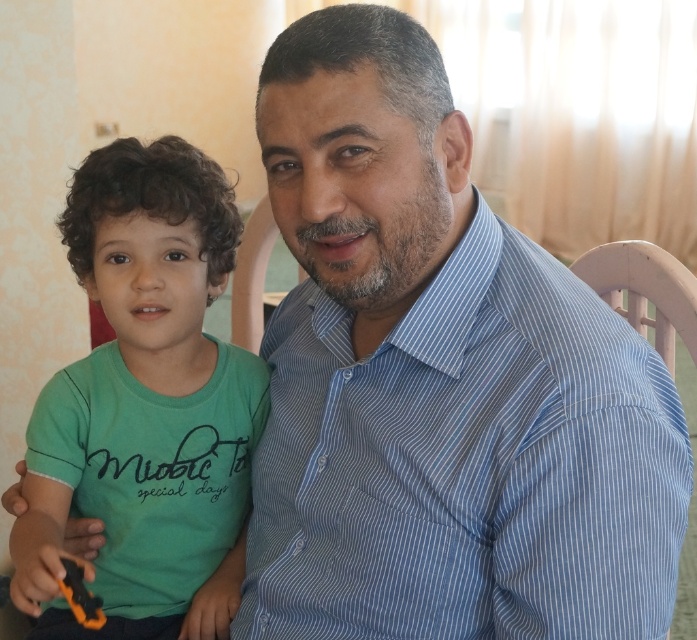
Who is positioned more to the left, green matte shirt at left or orange plastic toy at lower left?

orange plastic toy at lower left

Which is in front, point (256, 369) or point (79, 573)?

Point (79, 573) is more forward.

Describe the element at coordinates (155, 384) in the screenshot. The width and height of the screenshot is (697, 640). I see `green matte shirt at left` at that location.

The width and height of the screenshot is (697, 640). Identify the location of green matte shirt at left. coord(155,384).

Can you confirm if blue striped shirt at center is positioned below green matte shirt at left?

Yes.

Does blue striped shirt at center appear over green matte shirt at left?

No.

Does point (474, 392) come behind point (187, 627)?

No, it is not.

Image resolution: width=697 pixels, height=640 pixels. I want to click on blue striped shirt at center, so click(x=467, y=461).

Which is behind, point (279, 388) or point (76, 586)?

The point (279, 388) is more distant.

Which is in front, point (581, 300) or point (68, 595)?

Point (581, 300) is more forward.

This screenshot has width=697, height=640. I want to click on blue striped shirt at center, so click(x=467, y=461).